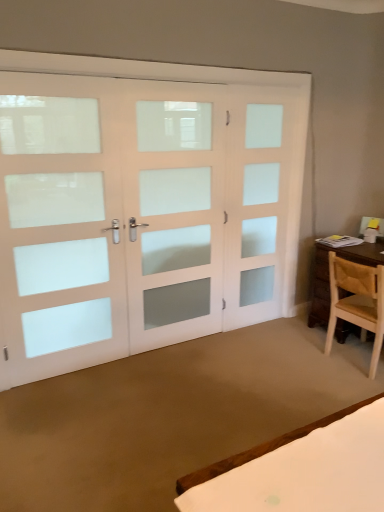
This screenshot has height=512, width=384. I want to click on free spot above white frosted glass door at left, positioned as the third screen door in right-to-left order (from a real-world perspective), so click(x=55, y=69).